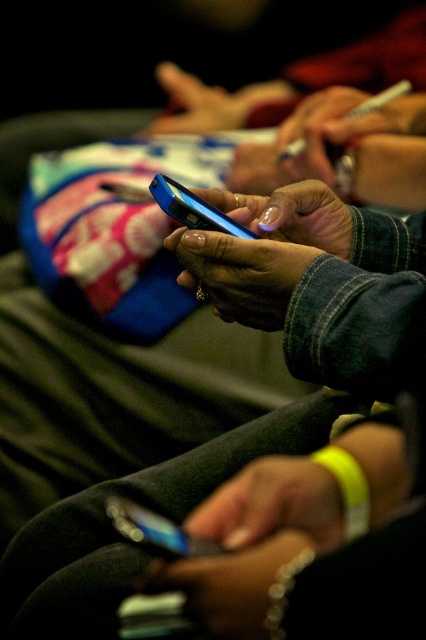
You are a photographer trying to capture a candid shot of the two people using their phones. You notice two points of interest marked as point 1 at coordinates point [268,228] and point 2 at coordinates point [184,536]. Which point should you focus on to ensure the subject in the foreground is sharp?

Point 2 at coordinates point [184,536] should be focused on because it is in the foreground and closer to the camera, ensuring the subject using the pink and white phone is sharp.

You are a photographer trying to capture both the matte blue phone at center and the shiny blue phone at center in a single frame. Given that your camera can only accommodate objects up to the width of the wider phone, which phone determines the maximum width your camera needs to handle?

The matte blue phone at center has a greater width than the shiny blue phone at center, so the camera must be able to handle at least the width of the matte blue phone at center to capture both phones in the frame.

You are a photographer focusing on capturing the details of the blue smartphone at center. You need to ensure that the point at coordinates (261, 250) is within the frame. Is this point located on the blue smartphone?

The point at coordinates (261, 250) is on the matte blue phone at center, so yes, it is located on the blue smartphone.